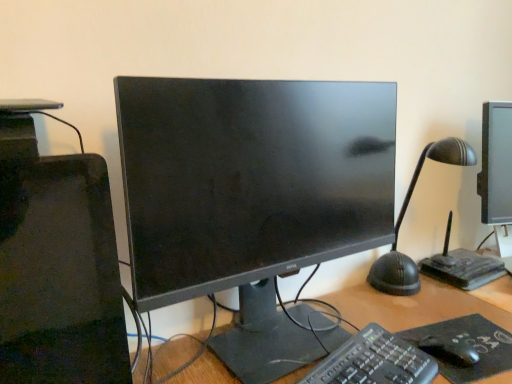
Question: Is the depth of black matte mouse at lower right less than that of matte black monitor at center?

Choices:
 (A) yes
 (B) no

Answer: (B)

Question: Considering the relative sizes of black matte mouse at lower right and matte black monitor at center in the image provided, is black matte mouse at lower right taller than matte black monitor at center?

Choices:
 (A) yes
 (B) no

Answer: (B)

Question: Is black matte mouse at lower right smaller than matte black monitor at center?

Choices:
 (A) no
 (B) yes

Answer: (B)

Question: Is matte black monitor at center at the back of black matte mouse at lower right?

Choices:
 (A) yes
 (B) no

Answer: (A)

Question: From the image's perspective, does black matte mouse at lower right appear higher than matte black monitor at center?

Choices:
 (A) no
 (B) yes

Answer: (A)

Question: Can you confirm if black matte mouse at lower right is shorter than matte black monitor at center?

Choices:
 (A) yes
 (B) no

Answer: (A)

Question: Is black matte mousepad at lower right not near black matte mouse at lower right?

Choices:
 (A) yes
 (B) no

Answer: (B)

Question: From the image's perspective, is black matte mousepad at lower right located above black matte mouse at lower right?

Choices:
 (A) yes
 (B) no

Answer: (B)

Question: Would you say black matte mousepad at lower right contains black matte mouse at lower right?

Choices:
 (A) yes
 (B) no

Answer: (A)

Question: Is black matte mousepad at lower right positioned before black matte mouse at lower right?

Choices:
 (A) yes
 (B) no

Answer: (A)

Question: Is black matte mouse at lower right at the back of black matte mousepad at lower right?

Choices:
 (A) no
 (B) yes

Answer: (A)

Question: Is black matte mousepad at lower right facing towards black matte mouse at lower right?

Choices:
 (A) no
 (B) yes

Answer: (A)

Question: Does matte black monitor at center have a lesser height compared to black plastic keyboard at center?

Choices:
 (A) yes
 (B) no

Answer: (B)